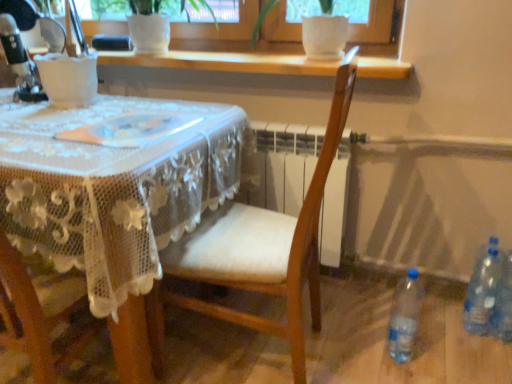
Locate an element on the screen. The width and height of the screenshot is (512, 384). free spot in front of clear plastic bottle at lower right, which ranks as the second bottle in right-to-left order is located at coordinates [x=478, y=356].